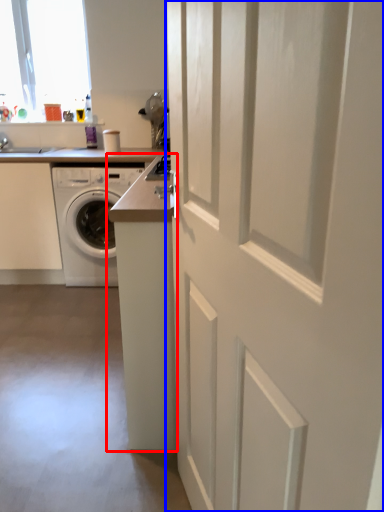
Question: Which of the following is the farthest to the observer, counter (highlighted by a red box) or door (highlighted by a blue box)?

Choices:
 (A) counter
 (B) door

Answer: (A)